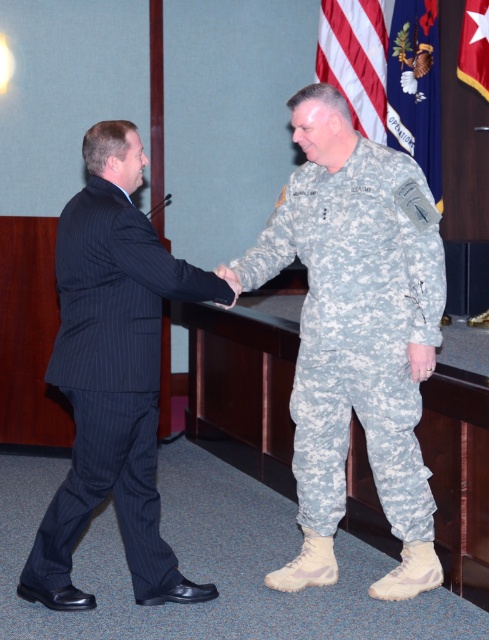
You are a photographer at the event and want to capture a closeup of the U.S. Army uniform patch. You notice a point at coordinates point (x=357, y=326). Based on the scene, where is this point located?

The point (x=357, y=326) is located on the camouflage fabric uniform at center, which is part of the U.S. Army uniform worn by the person on the right.

You are a photographer at the event and need to ensure both the black pinstripe suit at left and the silk flag at upper center are visible in your photo. Which object should you focus on first to ensure proper framing?

You should focus on the black pinstripe suit at left first since it is larger than the silk flag at upper center, ensuring it fits within the frame before adjusting for the smaller flag.

You are attending a formal event and notice two flags displayed in the background. The American flag at upper center and the red fabric flag at upper right. According to proper flag etiquette, which flag should be placed in a position of honor?

The American flag at upper center should be placed in the position of honor as it is larger in size than the red fabric flag at upper right, and according to etiquette, the U.S. flag should be displayed in a prominent position.